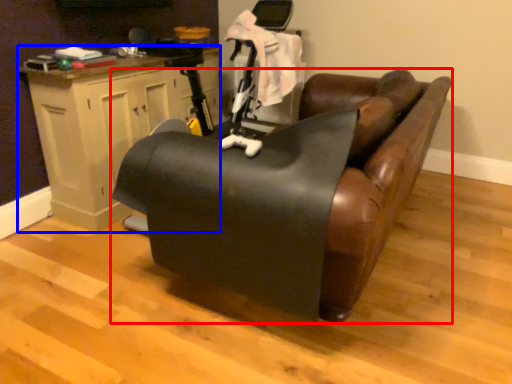
Question: Which object appears closest to the camera in this image, furniture (highlighted by a red box) or table (highlighted by a blue box)?

Choices:
 (A) furniture
 (B) table

Answer: (A)